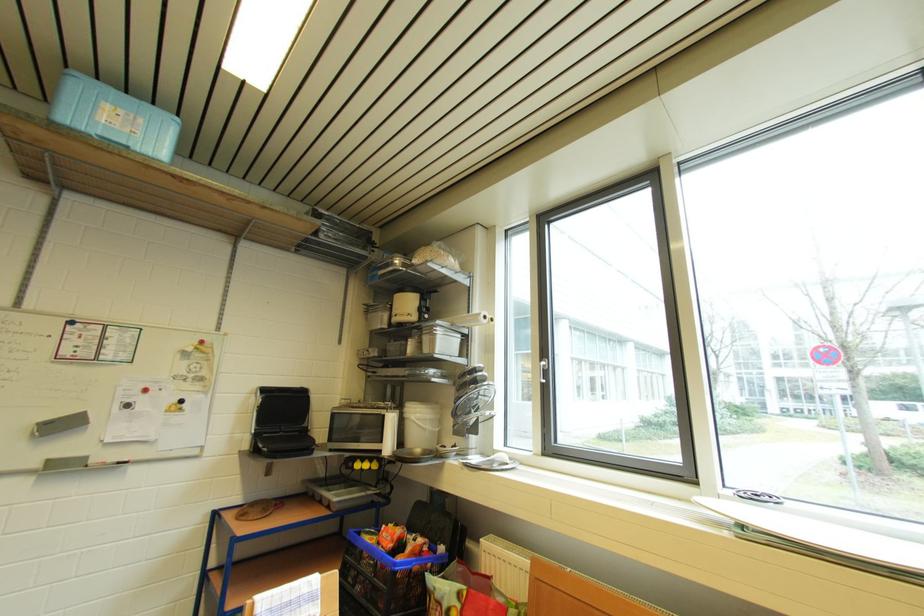
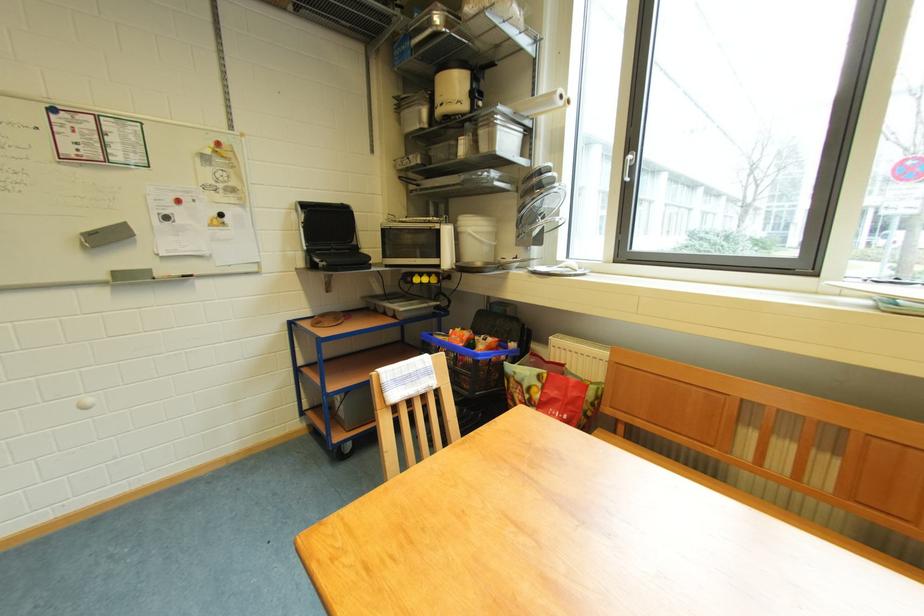
In a continuous first-person perspective shot, in which direction is the camera moving?

The cameraman walked toward left, forward.